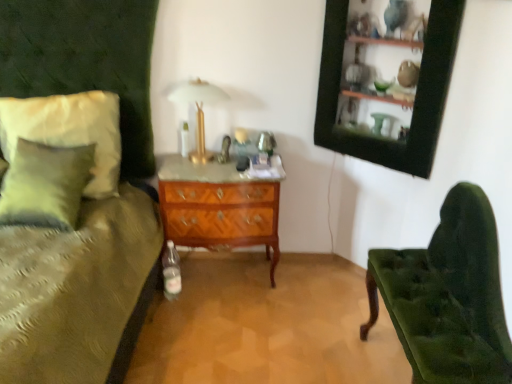
Measure the distance between point (x=456, y=381) and camera.

Point (x=456, y=381) is 4.02 feet away from camera.

Find the location of `soft white fabric pillow at left`. soft white fabric pillow at left is located at coordinates (69, 131).

At what (x,y) coordinates should I click in order to perform the action: click on gold metallic table lamp at upper center. Please return your answer as a coordinate pair (x, y). This screenshot has width=512, height=384. Looking at the image, I should click on (199, 110).

What do you see at coordinates (218, 207) in the screenshot? The image size is (512, 384). I see `woodenwoodenchest of drawers at center` at bounding box center [218, 207].

Locate an element on the screen. Image resolution: width=512 pixels, height=384 pixels. velvet green chair at right is located at coordinates (448, 296).

Is woodenwoodenchest of drawers at center at the back of gold metallic table lamp at upper center?

gold metallic table lamp at upper center is not turned away from woodenwoodenchest of drawers at center.

Would you say gold metallic table lamp at upper center is a long distance from woodenwoodenchest of drawers at center?

Actually, gold metallic table lamp at upper center and woodenwoodenchest of drawers at center are a little close together.

Considering the relative sizes of gold metallic table lamp at upper center and woodenwoodenchest of drawers at center in the image provided, is gold metallic table lamp at upper center bigger than woodenwoodenchest of drawers at center?

No, gold metallic table lamp at upper center is not bigger than woodenwoodenchest of drawers at center.

Considering the relative sizes of gold metallic table lamp at upper center and woodenwoodenchest of drawers at center in the image provided, is gold metallic table lamp at upper center shorter than woodenwoodenchest of drawers at center?

Indeed, gold metallic table lamp at upper center has a lesser height compared to woodenwoodenchest of drawers at center.

From a real-world perspective, which object rests below the other?

woodenwoodenchest of drawers at center is physically lower.

Which of these two, velvet green chair at right or woodenwoodenchest of drawers at center, is bigger?

Bigger between the two is velvet green chair at right.

Considering the relative sizes of velvet green chair at right and woodenwoodenchest of drawers at center in the image provided, is velvet green chair at right shorter than woodenwoodenchest of drawers at center?

No.

Consider the image. Is velvet green chair at right oriented away from woodenwoodenchest of drawers at center?

No, velvet green chair at right is not facing away from woodenwoodenchest of drawers at center.

Can you confirm if gold metallic table lamp at upper center is positioned to the left of soft white fabric pillow at left?

In fact, gold metallic table lamp at upper center is to the right of soft white fabric pillow at left.

Is gold metallic table lamp at upper center looking in the opposite direction of soft white fabric pillow at left?

No.

From the picture: Would you say gold metallic table lamp at upper center is outside soft white fabric pillow at left?

That's correct, gold metallic table lamp at upper center is outside of soft white fabric pillow at left.

Considering their positions, is velvet green chair at right located in front of or behind black wood picture frame at upper right?

Visually, velvet green chair at right is located in front of black wood picture frame at upper right.

From the image's perspective, is velvet green chair at right positioned above or below black wood picture frame at upper right?

Clearly, from the image's perspective, velvet green chair at right is below black wood picture frame at upper right.

Looking at this image, who is bigger, velvet green chair at right or black wood picture frame at upper right?

Bigger between the two is velvet green chair at right.

Relative to black wood picture frame at upper right, is woodenwoodenchest of drawers at center in front or behind?

woodenwoodenchest of drawers at center is positioned farther from the viewer than black wood picture frame at upper right.

Image resolution: width=512 pixels, height=384 pixels. I want to click on picture frame lying on the right of woodenwoodenchest of drawers at center, so click(x=387, y=82).

From the picture: Based on their sizes in the image, would you say woodenwoodenchest of drawers at center is bigger or smaller than black wood picture frame at upper right?

Considering their sizes, woodenwoodenchest of drawers at center takes up more space than black wood picture frame at upper right.

How different are the orientations of woodenwoodenchest of drawers at center and black wood picture frame at upper right in degrees?

The angular difference between woodenwoodenchest of drawers at center and black wood picture frame at upper right is 46.9 degrees.

Would you say woodenwoodenchest of drawers at center is inside or outside velvet green chair at right?

The correct answer is: outside.

Considering the relative positions of woodenwoodenchest of drawers at center and velvet green chair at right in the image provided, is woodenwoodenchest of drawers at center behind velvet green chair at right?

Yes, woodenwoodenchest of drawers at center is behind velvet green chair at right.

Can you confirm if woodenwoodenchest of drawers at center is taller than velvet green chair at right?

In fact, woodenwoodenchest of drawers at center may be shorter than velvet green chair at right.

Is woodenwoodenchest of drawers at center at the right side of velvet green chair at right?

Incorrect, woodenwoodenchest of drawers at center is not on the right side of velvet green chair at right.

At what (x,y) coordinates should I click in order to perform the action: click on table lamp that is behind the velvet green chair at right. Please return your answer as a coordinate pair (x, y). Looking at the image, I should click on (199, 110).

Is gold metallic table lamp at upper center facing towards velvet green chair at right?

No, gold metallic table lamp at upper center is not turned towards velvet green chair at right.

Does gold metallic table lamp at upper center have a lesser height compared to velvet green chair at right?

Yes, gold metallic table lamp at upper center is shorter than velvet green chair at right.

Considering the positions of objects gold metallic table lamp at upper center and velvet green chair at right in the image provided, who is more to the right, gold metallic table lamp at upper center or velvet green chair at right?

Positioned to the right is velvet green chair at right.

Locate an element on the screen. The image size is (512, 384). chest of drawers to the right of gold metallic table lamp at upper center is located at coordinates (218, 207).

Where is `the chest of drawers that appears below the velvet green chair at right (from a real-world perspective)`? the chest of drawers that appears below the velvet green chair at right (from a real-world perspective) is located at coordinates (218, 207).

Based on the photo, estimate the real-world distances between objects in this image. Which object is closer to velvet green chair at right, gold metallic table lamp at upper center or woodenwoodenchest of drawers at center?

Among the two, woodenwoodenchest of drawers at center is located nearer to velvet green chair at right.

Based on their spatial positions, is gold metallic table lamp at upper center or velvet green chair at right closer to soft white fabric pillow at left?

Among the two, gold metallic table lamp at upper center is located nearer to soft white fabric pillow at left.

Which object lies nearer to the anchor point woodenwoodenchest of drawers at center, black wood picture frame at upper right or soft white fabric pillow at left?

soft white fabric pillow at left is closer to woodenwoodenchest of drawers at center.

Considering their positions, is velvet green chair at right positioned further to gold metallic table lamp at upper center than black wood picture frame at upper right?

The object further to gold metallic table lamp at upper center is velvet green chair at right.

Considering their positions, is soft white fabric pillow at left positioned closer to velvet green chair at right than black wood picture frame at upper right?

black wood picture frame at upper right is positioned closer to the anchor velvet green chair at right.

Which object lies further to the anchor point black wood picture frame at upper right, gold metallic table lamp at upper center or velvet green chair at right?

Among the two, gold metallic table lamp at upper center is located further to black wood picture frame at upper right.

Looking at the image, which one is located closer to woodenwoodenchest of drawers at center, velvet green chair at right or gold metallic table lamp at upper center?

Among the two, gold metallic table lamp at upper center is located nearer to woodenwoodenchest of drawers at center.

Estimate the real-world distances between objects in this image. Which object is closer to gold metallic table lamp at upper center, velvet green chair at right or woodenwoodenchest of drawers at center?

Among the two, woodenwoodenchest of drawers at center is located nearer to gold metallic table lamp at upper center.

Identify the location of the chest of drawers positioned between velvet green chair at right and gold metallic table lamp at upper center from near to far. The width and height of the screenshot is (512, 384). (218, 207).

Locate an element on the screen. Image resolution: width=512 pixels, height=384 pixels. chest of drawers between gold metallic table lamp at upper center and black wood picture frame at upper right is located at coordinates (218, 207).

Where is `table lamp between soft white fabric pillow at left and black wood picture frame at upper right in the horizontal direction`? table lamp between soft white fabric pillow at left and black wood picture frame at upper right in the horizontal direction is located at coordinates (199, 110).

Where is `picture frame between velvet green chair at right and woodenwoodenchest of drawers at center along the z-axis`? The height and width of the screenshot is (384, 512). picture frame between velvet green chair at right and woodenwoodenchest of drawers at center along the z-axis is located at coordinates (387, 82).